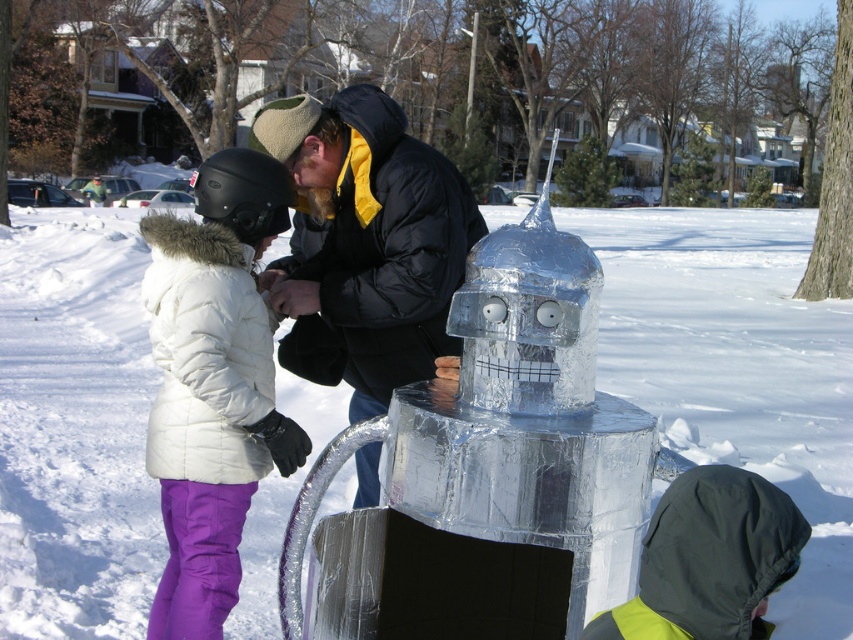
Does white puffy jacket at left appear over black puffy jacket at center?

No.

Who is higher up, white puffy jacket at left or black puffy jacket at center?

black puffy jacket at center is higher up.

Does point (254, 188) come farther from viewer compared to point (367, 349)?

No, (254, 188) is closer to viewer.

Image resolution: width=853 pixels, height=640 pixels. Identify the location of white puffy jacket at left. (213, 384).

Can you confirm if shiny metallic robot at center is positioned above white puffy jacket at left?

Yes.

Who is taller, shiny metallic robot at center or white puffy jacket at left?

Standing taller between the two is shiny metallic robot at center.

I want to click on shiny metallic robot at center, so click(x=737, y=368).

Where is `shiny metallic robot at center`? shiny metallic robot at center is located at coordinates (737, 368).

Which is more to the left, shiny metallic robot at center or black puffy jacket at center?

black puffy jacket at center

Can you confirm if shiny metallic robot at center is bigger than black puffy jacket at center?

Yes.

Between point (86, 380) and point (318, 323), which one is positioned in front?

Point (318, 323) is more forward.

Identify the location of shiny metallic robot at center. This screenshot has width=853, height=640. (737, 368).